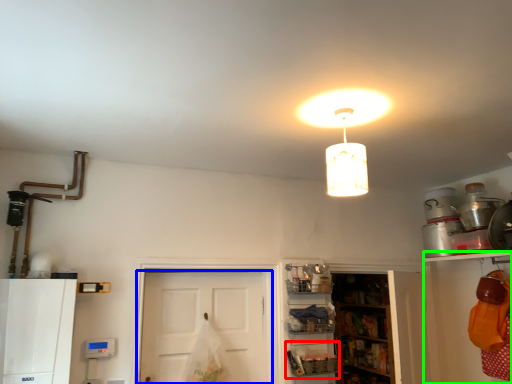
Question: Estimate the real-world distances between objects in this image. Which object is farther from shelf (highlighted by a red box), door (highlighted by a blue box) or shelf (highlighted by a green box)?

Choices:
 (A) door
 (B) shelf

Answer: (B)